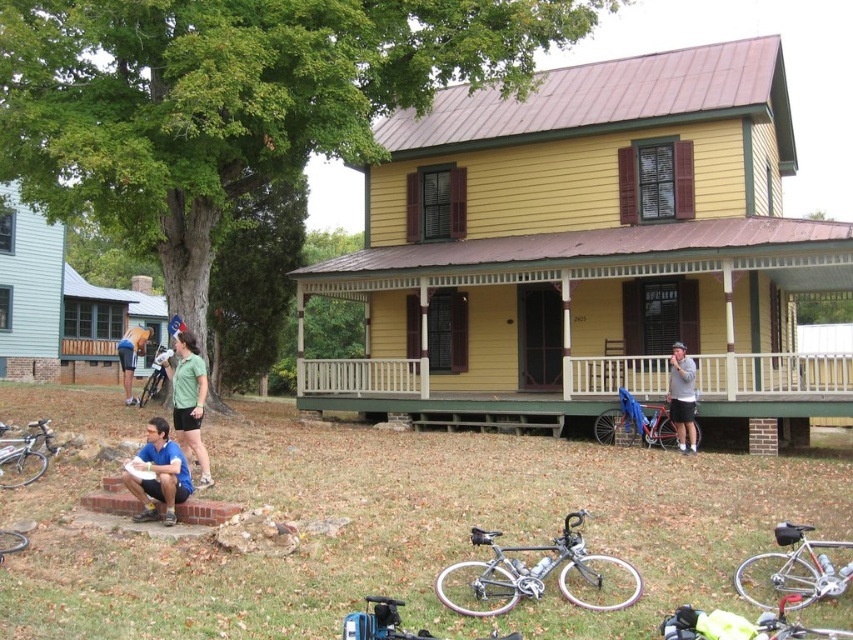
Which is more to the left, metallic silver bicycle at lower center or red metallic bicycle at center-right?

From the viewer's perspective, metallic silver bicycle at lower center appears more on the left side.

Based on the photo, does metallic silver bicycle at lower center lie behind red metallic bicycle at center-right?

No, it is in front of red metallic bicycle at center-right.

Who is more distant from viewer, (x=57, y=582) or (x=631, y=417)?

Point (x=631, y=417)

In order to click on metallic silver bicycle at lower center in this screenshot , I will do `click(424, 532)`.

Is red metallic bicycle at center-right in front of blue-green fabric shorts at lower left?

Yes, red metallic bicycle at center-right is closer to the viewer.

Between point (668, 413) and point (134, 362), which one is positioned in front?

Positioned in front is point (668, 413).

What do you see at coordinates (636, 422) in the screenshot? The width and height of the screenshot is (853, 640). I see `red metallic bicycle at center-right` at bounding box center [636, 422].

I want to click on red metallic bicycle at center-right, so click(636, 422).

Is the position of shiny metallic bicycle at center more distant than that of blue fabric shorts at lower left?

No.

Between shiny metallic bicycle at center and blue fabric shorts at lower left, which one appears on the right side from the viewer's perspective?

shiny metallic bicycle at center is more to the right.

Is point (511, 566) closer to camera compared to point (155, 420)?

Yes, point (511, 566) is in front of point (155, 420).

Locate an element on the screen. shiny metallic bicycle at center is located at coordinates (537, 576).